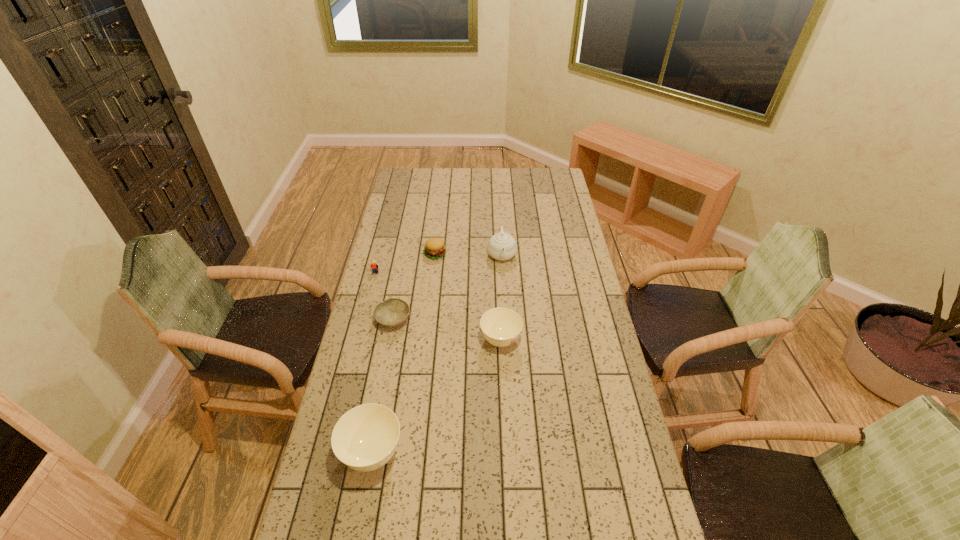
Where is `vacant area situated on the front of the shorter sugar bowl`? Image resolution: width=960 pixels, height=540 pixels. vacant area situated on the front of the shorter sugar bowl is located at coordinates (503, 399).

Find the location of a particular element. Image resolution: width=960 pixels, height=540 pixels. free space located 0.310m on the back of the second shortest object is located at coordinates (440, 207).

Find the location of a particular element. The image size is (960, 540). vacant region located on the back of the bowl is located at coordinates (407, 247).

At what (x,y) coordinates should I click in order to perform the action: click on vacant space positioned on the front-facing side of the leftmost object. Please return your answer as a coordinate pair (x, y). This screenshot has width=960, height=540. Looking at the image, I should click on (369, 302).

The image size is (960, 540). What are the coordinates of `free region located on the spout of the chinaware` in the screenshot? It's located at (505, 313).

You are a GUI agent. You are given a task and a screenshot of the screen. Output one action in this format:
    pyautogui.click(x=<x>, y=<y>)
    Task: Click on the sugar bowl present at the left edge
    This screenshot has height=540, width=960.
    Given the screenshot: What is the action you would take?
    pyautogui.click(x=365, y=438)

Locate an element on the screen. bowl that is at the left edge is located at coordinates (392, 312).

This screenshot has height=540, width=960. Find the location of `Lego positioned at the left edge`. Lego positioned at the left edge is located at coordinates (373, 266).

In the image, there is a desktop. Where is `blank space at the far edge`? blank space at the far edge is located at coordinates (493, 177).

In the image, there is a desktop. At what (x,y) coordinates should I click in order to perform the action: click on vacant space at the near edge. Please return your answer as a coordinate pair (x, y). Looking at the image, I should click on (572, 531).